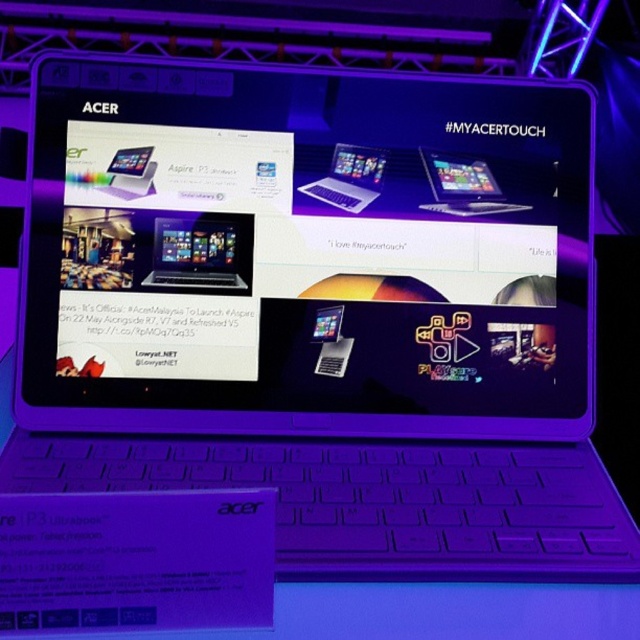
You are looking at the laptop screen and notice two points marked on it. The first is at point (147, 275) and the second at point (346, 170). According to the scene description, which point is closer to you?

Point (147, 275) is in front of point (346, 170), so it is closer to you.

You are looking at the laptop screen and want to touch the matte black laptop at center and the silver metallic laptop at center. Which one can you physically reach by just moving your hand forward without moving your body?

The matte black laptop at center is closer to the viewer than the silver metallic laptop at center, so you can physically reach the matte black laptop at center by moving your hand forward without moving your body.